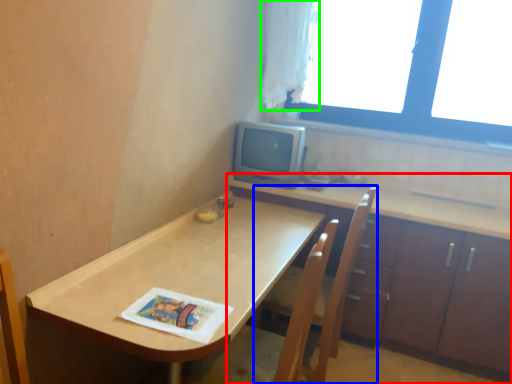
Question: Which is farther away from cabinetry (highlighted by a red box)? armchair (highlighted by a blue box) or curtain (highlighted by a green box)?

Choices:
 (A) armchair
 (B) curtain

Answer: (B)